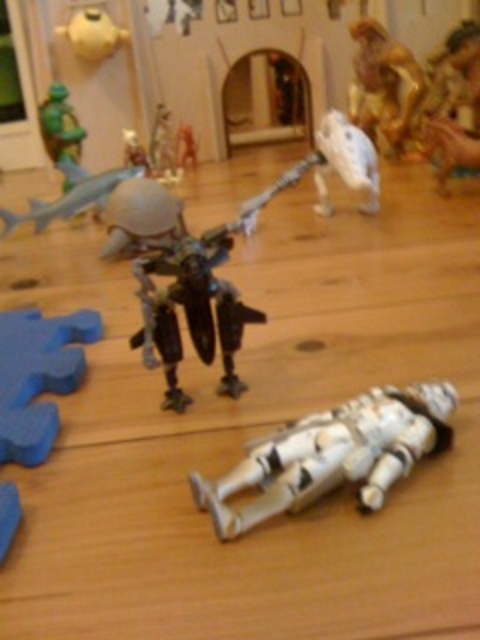
Question: Does blue matte shark at upper left appear over green matte turtle at upper left?

Choices:
 (A) no
 (B) yes

Answer: (A)

Question: Is white plastic astronaut at lower center positioned behind gold metallic statue at upper right?

Choices:
 (A) yes
 (B) no

Answer: (B)

Question: Among these objects, which one is nearest to the camera?

Choices:
 (A) gold metallic statue at upper right
 (B) metallic silver robot at center
 (C) green matte turtle at upper left

Answer: (B)

Question: Estimate the real-world distances between objects in this image. Which object is closer to the blue matte shark at upper left?

Choices:
 (A) metallic silver robot at center
 (B) gold metallic statue at upper right

Answer: (A)

Question: Is gold metallic statue at upper right closer to camera compared to blue matte shark at upper left?

Choices:
 (A) yes
 (B) no

Answer: (B)

Question: Which point appears closest to the camera in this image?

Choices:
 (A) (348, 140)
 (B) (66, 195)

Answer: (A)